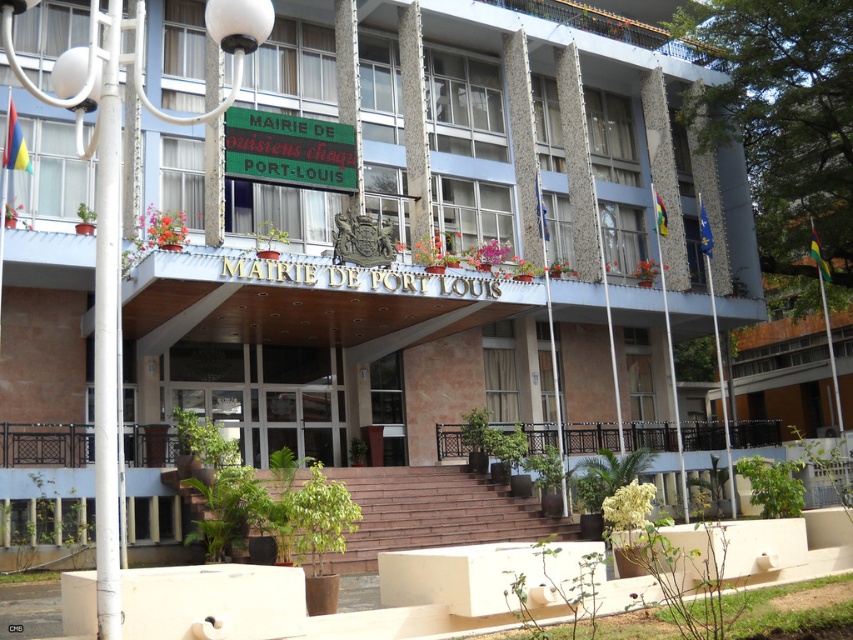
You are visiting the Mairie de Port Louis and want to enter through the transparent glass doors at center. However, you notice a green plastic sign at upper center above the entrance. Which object is located to the left of the other?

The transparent glass doors at center is positioned on the left side of green plastic sign at upper center, so the transparent glass doors at center is to the left of the green plastic sign at upper center.

You are a delivery person arriving at the Mairie de Port Louis. You need to enter through the transparent glass doors at center. However, there is a green plastic sign at upper center above them. Can you walk through the doors without hitting your head on the sign?

The transparent glass doors at center is much taller than the green plastic sign at upper center, so you can walk through the doors without hitting your head on the sign.

Based on the photo, you are standing in front of the Mairie de Port Louis building and want to enter through the transparent glass doors at center. Considering the distance between you and the doors, can you estimate how many steps you need to take to reach them?

The distance between you and the transparent glass doors at center is 79.40 feet. Assuming an average step length of about 2.5 feet, you would need approximately 32 steps to reach the doors.